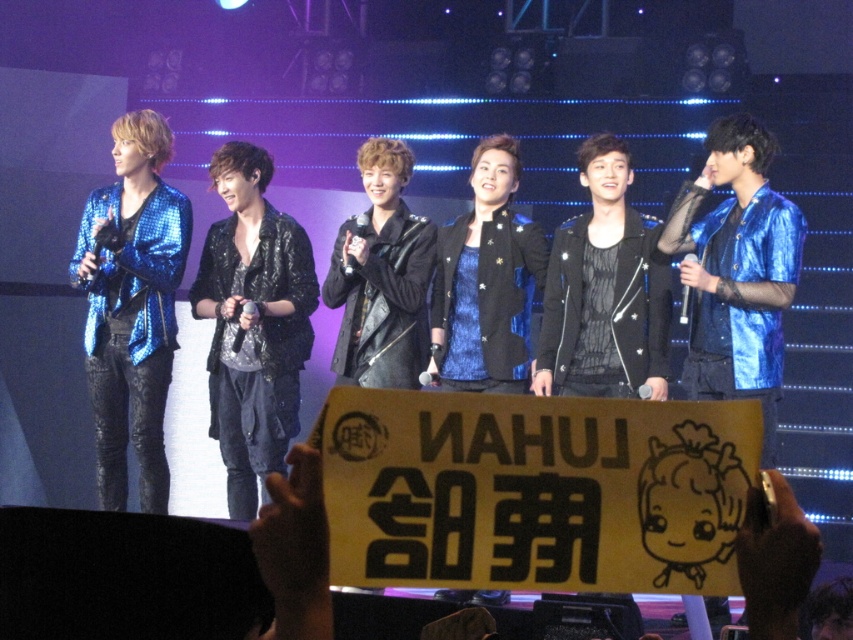
What do you see at coordinates (253, 321) in the screenshot? The height and width of the screenshot is (640, 853). I see `shiny black jacket at center` at bounding box center [253, 321].

Does shiny black jacket at center appear on the right side of shiny blue jacket at right?

No, shiny black jacket at center is not to the right of shiny blue jacket at right.

Which is behind, point (231, 310) or point (780, 211)?

The point (231, 310) is more distant.

Image resolution: width=853 pixels, height=640 pixels. What are the coordinates of `shiny black jacket at center` in the screenshot? It's located at (253, 321).

Does shiny blue jacket at left appear under shiny black jacket at center?

No, shiny blue jacket at left is not below shiny black jacket at center.

Who is more distant from viewer, (136, 161) or (244, 369)?

The point (136, 161) is behind.

This screenshot has height=640, width=853. What do you see at coordinates (132, 307) in the screenshot?
I see `shiny blue jacket at left` at bounding box center [132, 307].

Image resolution: width=853 pixels, height=640 pixels. I want to click on shiny blue jacket at left, so click(132, 307).

Can you confirm if shiny blue jacket at left is positioned above shiny blue jacket at right?

Actually, shiny blue jacket at left is below shiny blue jacket at right.

Between point (135, 259) and point (761, 218), which one is positioned in front?

Point (761, 218)

This screenshot has width=853, height=640. Find the location of `shiny blue jacket at left`. shiny blue jacket at left is located at coordinates (132, 307).